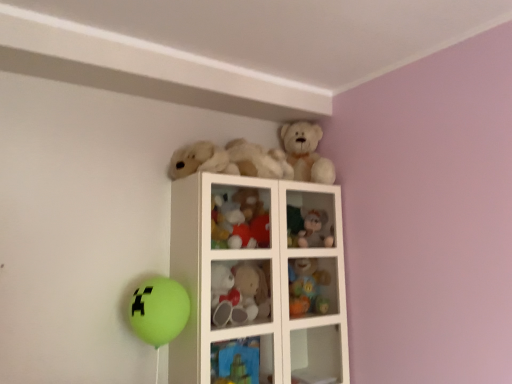
Measure the distance between fuzzy fabric teddy bear at upper center, the first cabinet when ordered from right to left, and camera.

fuzzy fabric teddy bear at upper center, the first cabinet when ordered from right to left, is 2.12 meters from camera.

This screenshot has width=512, height=384. What do you see at coordinates (310, 219) in the screenshot? I see `fuzzy fabric teddy bear at upper center, the first cabinet when ordered from back to front` at bounding box center [310, 219].

Measure the distance between point (268, 264) and camera.

1.94 meters.

This screenshot has height=384, width=512. What do you see at coordinates (306, 153) in the screenshot?
I see `white plush bear at upper center, which appears as the 5th toy when ordered from the bottom` at bounding box center [306, 153].

How much space does blue fabric toy at upper center, the 1th cabinet when ordered from front to back, occupy horizontally?

blue fabric toy at upper center, the 1th cabinet when ordered from front to back, is 4.75 inches wide.

This screenshot has width=512, height=384. What do you see at coordinates (307, 287) in the screenshot? I see `plush toy at upper right, which is the 5th toy from top to bottom` at bounding box center [307, 287].

Locate an element on the screen. Image resolution: width=512 pixels, height=384 pixels. fuzzy fabric teddy bear at upper center, the first cabinet positioned from the top is located at coordinates (310, 219).

Considering the sizes of plush toy at upper right, which is the 5th toy from top to bottom, and white glass cabinet at upper center in the image, is plush toy at upper right, which is the 5th toy from top to bottom, taller or shorter than white glass cabinet at upper center?

Clearly, plush toy at upper right, which is the 5th toy from top to bottom, is shorter compared to white glass cabinet at upper center.

Where is `toy that is the 1st object above the white glass cabinet at upper center (from a real-world perspective)`? toy that is the 1st object above the white glass cabinet at upper center (from a real-world perspective) is located at coordinates (307, 287).

Based on their positions, is plush toy at upper right, marked as the 1th toy in a bottom-to-top arrangement, located to the left or right of white glass cabinet at upper center?

plush toy at upper right, marked as the 1th toy in a bottom-to-top arrangement, is to the right of white glass cabinet at upper center.

Based on the photo, is plush toy at upper right, marked as the 1th toy in a bottom-to-top arrangement, spatially inside white glass cabinet at upper center, or outside of it?

plush toy at upper right, marked as the 1th toy in a bottom-to-top arrangement, is inside white glass cabinet at upper center.

Does fuzzy fabric teddy bear at upper center, the second cabinet in the bottom-to-top sequence, have a lesser width compared to white plush bear at upper center, which appears as the 5th toy when ordered from the bottom?

Yes, fuzzy fabric teddy bear at upper center, the second cabinet in the bottom-to-top sequence, is thinner than white plush bear at upper center, which appears as the 5th toy when ordered from the bottom.

Does fuzzy fabric teddy bear at upper center, the second cabinet in the bottom-to-top sequence, turn towards white plush bear at upper center, the first toy viewed from the top?

No.

Between fuzzy fabric teddy bear at upper center, positioned as the 2th cabinet in front-to-back order, and white plush bear at upper center, the first toy viewed from the top, which one is positioned behind?

fuzzy fabric teddy bear at upper center, positioned as the 2th cabinet in front-to-back order, is behind.

Which of these two, fuzzy fabric teddy bear at upper center, the first cabinet when ordered from right to left, or white plush bear at upper center, the first toy viewed from the top, stands taller?

white plush bear at upper center, the first toy viewed from the top.

Between white plush bear at upper center, the first toy viewed from the top, and white glass cabinet at upper center, which one appears on the left side from the viewer's perspective?

white glass cabinet at upper center.

Measure the distance between white plush bear at upper center, the first toy viewed from the top, and white glass cabinet at upper center.

white plush bear at upper center, the first toy viewed from the top, and white glass cabinet at upper center are 52.96 centimeters apart from each other.

Does point (317, 132) lie behind point (198, 181)?

Yes, point (317, 132) is farther from viewer.

Who is bigger, white plush bear at upper center, the first toy viewed from the top, or white glass cabinet at upper center?

With larger size is white glass cabinet at upper center.

Relative to green matte balloon at lower left, is plush toy at upper right, marked as the 1th toy in a bottom-to-top arrangement, in front or behind?

Visually, plush toy at upper right, marked as the 1th toy in a bottom-to-top arrangement, is located behind green matte balloon at lower left.

Is plush toy at upper right, marked as the 1th toy in a bottom-to-top arrangement, turned away from green matte balloon at lower left?

plush toy at upper right, marked as the 1th toy in a bottom-to-top arrangement, is not turned away from green matte balloon at lower left.

Which is nearer, (x=295, y=267) or (x=140, y=323)?

Point (x=295, y=267) is farther from the camera than point (x=140, y=323).

From a real-world perspective, who is located lower, plush toy at upper right, marked as the 1th toy in a bottom-to-top arrangement, or green matte balloon at lower left?

green matte balloon at lower left, from a real-world perspective.

Can we say blue fabric toy at upper center, the second cabinet positioned from the back, lies outside fluffy white teddy bear at upper center, marked as the fourth toy in a bottom-to-top arrangement?

Yes, blue fabric toy at upper center, the second cabinet positioned from the back, is located beyond the bounds of fluffy white teddy bear at upper center, marked as the fourth toy in a bottom-to-top arrangement.

Which of these two, blue fabric toy at upper center, which appears as the first cabinet when viewed from the left, or fluffy white teddy bear at upper center, marked as the fourth toy in a bottom-to-top arrangement, is bigger?

With larger size is fluffy white teddy bear at upper center, marked as the fourth toy in a bottom-to-top arrangement.

Could you measure the distance between blue fabric toy at upper center, arranged as the 2th cabinet when viewed from the right, and fluffy white teddy bear at upper center, the 2th toy in the top-to-bottom sequence?

blue fabric toy at upper center, arranged as the 2th cabinet when viewed from the right, and fluffy white teddy bear at upper center, the 2th toy in the top-to-bottom sequence, are 33.56 inches apart from each other.

Based on the photo, considering the sizes of blue fabric toy at upper center, which appears as the first cabinet when viewed from the left, and fluffy white teddy bear at upper center, marked as the fourth toy in a bottom-to-top arrangement, in the image, is blue fabric toy at upper center, which appears as the first cabinet when viewed from the left, wider or thinner than fluffy white teddy bear at upper center, marked as the fourth toy in a bottom-to-top arrangement,?

Considering their sizes, blue fabric toy at upper center, which appears as the first cabinet when viewed from the left, looks slimmer than fluffy white teddy bear at upper center, marked as the fourth toy in a bottom-to-top arrangement.

From a real-world perspective, which is physically above, green matte balloon at lower left or fluffy plush toys at upper center, placed as the third toy when sorted from top to bottom?

fluffy plush toys at upper center, placed as the third toy when sorted from top to bottom, from a real-world perspective.

Measure the distance from green matte balloon at lower left to fluffy plush toys at upper center, acting as the third toy starting from the bottom.

green matte balloon at lower left and fluffy plush toys at upper center, acting as the third toy starting from the bottom, are 17.59 inches apart.

Would you say green matte balloon at lower left is inside or outside fluffy plush toys at upper center, placed as the third toy when sorted from top to bottom?

green matte balloon at lower left is outside fluffy plush toys at upper center, placed as the third toy when sorted from top to bottom.

Does point (160, 286) come behind point (236, 224)?

No, (160, 286) is closer to viewer.

Is fluffy white teddy bear at upper center, the 2th toy in the top-to-bottom sequence, to the right of green matte balloon at lower left from the viewer's perspective?

Correct, you'll find fluffy white teddy bear at upper center, the 2th toy in the top-to-bottom sequence, to the right of green matte balloon at lower left.

Relative to green matte balloon at lower left, is fluffy white teddy bear at upper center, marked as the fourth toy in a bottom-to-top arrangement, in front or behind?

fluffy white teddy bear at upper center, marked as the fourth toy in a bottom-to-top arrangement, is positioned farther from the viewer than green matte balloon at lower left.

Could green matte balloon at lower left be considered to be inside fluffy white teddy bear at upper center, marked as the fourth toy in a bottom-to-top arrangement?

No.

Is point (253, 166) positioned before point (149, 294)?

No.

This screenshot has width=512, height=384. I want to click on shelf below the plush toy at upper right, marked as the 1th toy in a bottom-to-top arrangement (from a real-world perspective), so click(260, 278).

There is a fuzzy fabric teddy bear at upper center, the first cabinet positioned from the top. Identify the location of the 3rd toy above it (from a real-world perspective). This screenshot has height=384, width=512. (306, 153).

When comparing their distances from white plush bear at upper center, which appears as the 5th toy when ordered from the bottom, does plush toy at upper right, marked as the 1th toy in a bottom-to-top arrangement, or fluffy white teddy bear at upper center, the 2th toy in the top-to-bottom sequence, seem closer?

fluffy white teddy bear at upper center, the 2th toy in the top-to-bottom sequence, is closer to white plush bear at upper center, which appears as the 5th toy when ordered from the bottom.

Considering their positions, is white glass cabinet at upper center positioned further to plush toy at upper right, marked as the 1th toy in a bottom-to-top arrangement, than green matte balloon at lower left?

green matte balloon at lower left lies further to plush toy at upper right, marked as the 1th toy in a bottom-to-top arrangement, than the other object.

Estimate the real-world distances between objects in this image. Which object is closer to fluffy white teddy bear at upper center, marked as the fourth toy in a bottom-to-top arrangement, white glass cabinet at upper center or fluffy beige teddy bear at upper center, the 4th toy in the top-to-bottom sequence?

Based on the image, white glass cabinet at upper center appears to be nearer to fluffy white teddy bear at upper center, marked as the fourth toy in a bottom-to-top arrangement.

From the image, which object appears to be farther from white plush bear at upper center, the first toy viewed from the top, fluffy beige teddy bear at upper center, the 4th toy in the top-to-bottom sequence, or blue fabric toy at upper center, the 1th cabinet when ordered from front to back?

blue fabric toy at upper center, the 1th cabinet when ordered from front to back.

Based on the photo, looking at the image, which one is located further to plush toy at upper right, marked as the 1th toy in a bottom-to-top arrangement, fluffy white teddy bear at upper center, marked as the fourth toy in a bottom-to-top arrangement, or blue fabric toy at upper center, arranged as the 2th cabinet when viewed from the right?

fluffy white teddy bear at upper center, marked as the fourth toy in a bottom-to-top arrangement, is positioned further to the anchor plush toy at upper right, marked as the 1th toy in a bottom-to-top arrangement.

From the image, which object appears to be nearer to green matte balloon at lower left, blue fabric toy at upper center, the second cabinet viewed from the top, or fuzzy fabric teddy bear at upper center, the second cabinet in the bottom-to-top sequence?

blue fabric toy at upper center, the second cabinet viewed from the top, lies closer to green matte balloon at lower left than the other object.

Looking at the image, which one is located closer to green matte balloon at lower left, fuzzy fabric teddy bear at upper center, the first cabinet when ordered from back to front, or white plush bear at upper center, the first toy viewed from the top?

The object closer to green matte balloon at lower left is fuzzy fabric teddy bear at upper center, the first cabinet when ordered from back to front.

Based on their spatial positions, is plush toy at upper right, marked as the 1th toy in a bottom-to-top arrangement, or fuzzy fabric teddy bear at upper center, positioned as the 2th cabinet in front-to-back order, closer to green matte balloon at lower left?

Among the two, plush toy at upper right, marked as the 1th toy in a bottom-to-top arrangement, is located nearer to green matte balloon at lower left.

Find the location of `cabinet between white plush bear at upper center, which appears as the 5th toy when ordered from the bottom, and fluffy beige teddy bear at upper center, the 4th toy in the top-to-bottom sequence, in the vertical direction`. cabinet between white plush bear at upper center, which appears as the 5th toy when ordered from the bottom, and fluffy beige teddy bear at upper center, the 4th toy in the top-to-bottom sequence, in the vertical direction is located at coordinates (310, 219).

Locate an element on the screen. The image size is (512, 384). shelf that lies between fluffy beige teddy bear at upper center, the 4th toy in the top-to-bottom sequence, and blue fabric toy at upper center, the second cabinet viewed from the top, from top to bottom is located at coordinates (260, 278).

What are the coordinates of `shelf that lies between fluffy plush toys at upper center, placed as the third toy when sorted from top to bottom, and green matte balloon at lower left from top to bottom` in the screenshot? It's located at (260, 278).

At what (x,y) coordinates should I click in order to perform the action: click on cabinet between fluffy plush toys at upper center, acting as the third toy starting from the bottom, and blue fabric toy at upper center, the second cabinet viewed from the top, in the vertical direction. Please return your answer as a coordinate pair (x, y). The height and width of the screenshot is (384, 512). Looking at the image, I should click on (310, 219).